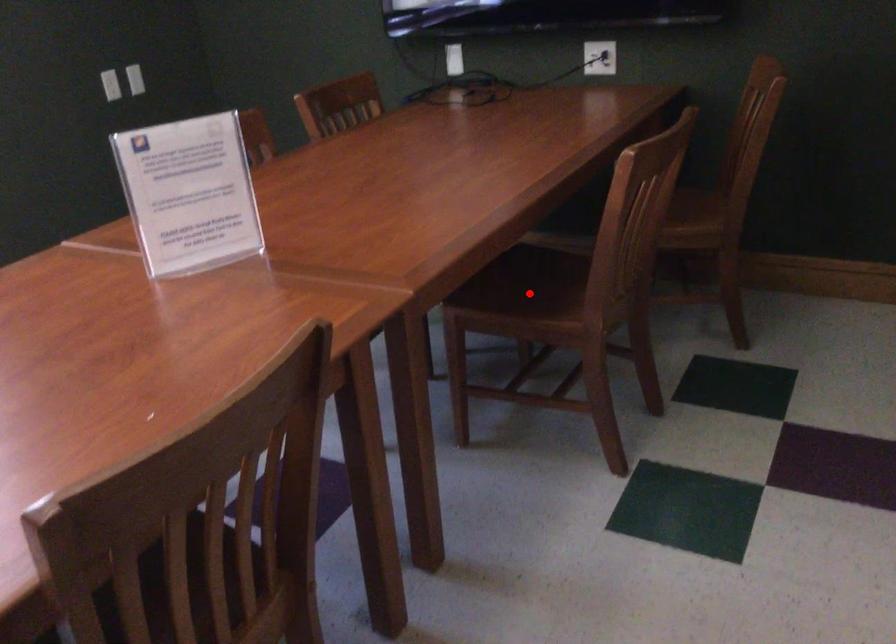
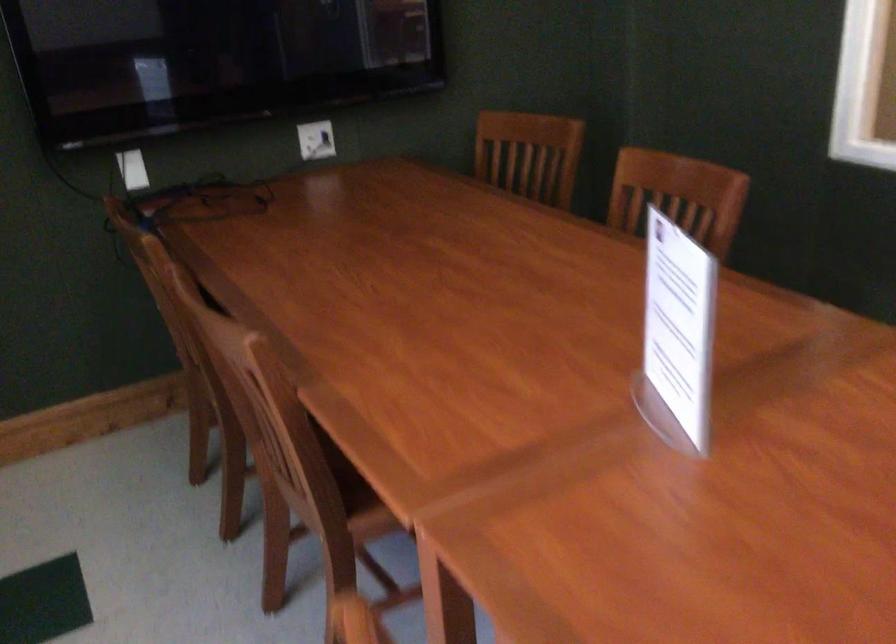
Question: I am providing you with two images of the same scene from different viewpoints. A red point is marked on the first image. Is the red point's position out of view in image 2?

Choices:
 (A) Yes
 (B) No

Answer: (A)